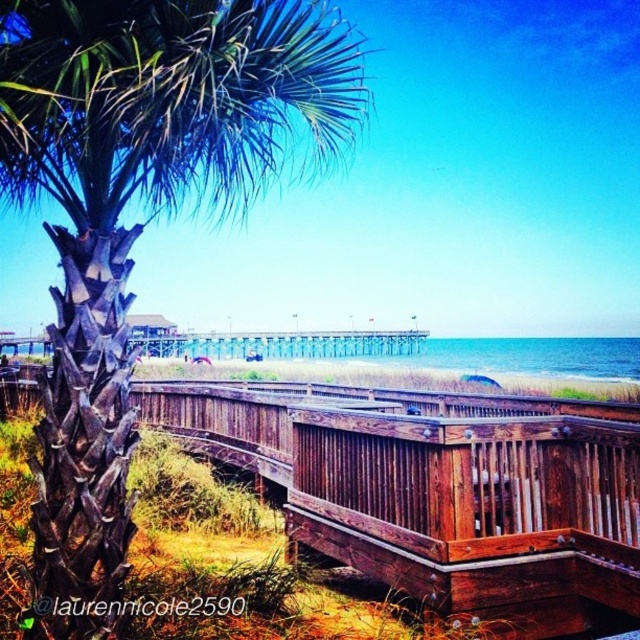
You are standing on the wooden boardwalk and want to take a photo of the palm tree. If you move 5 feet closer to the palm tree, will you be closer than 10 feet away from the point at point (x=52, y=564)?

The distance of point (x=52, y=564) from viewer is 11.20 feet. If you move 5 feet closer, your new distance would be 6.20 feet from the point, which is less than 10 feet. Therefore, you will be closer than 10 feet away from the point (x=52, y=564).

In the scene shown: You are standing on the wooden boardwalk and want to take a photo of both the dark brown textured palm tree at left and the blue water at center. Which object should you focus on first to ensure both are in the frame?

You should focus on the dark brown textured palm tree at left first because it is closer to the viewer than the blue water at center. By focusing on the closer object, the background will still be in focus, ensuring both are captured clearly.

You are standing on the brown wooden deck at center and looking towards the dark brown textured palm tree at left. Which object is higher in elevation?

The dark brown textured palm tree at left is higher in elevation than the brown wooden deck at center because it is positioned above it in the scene.